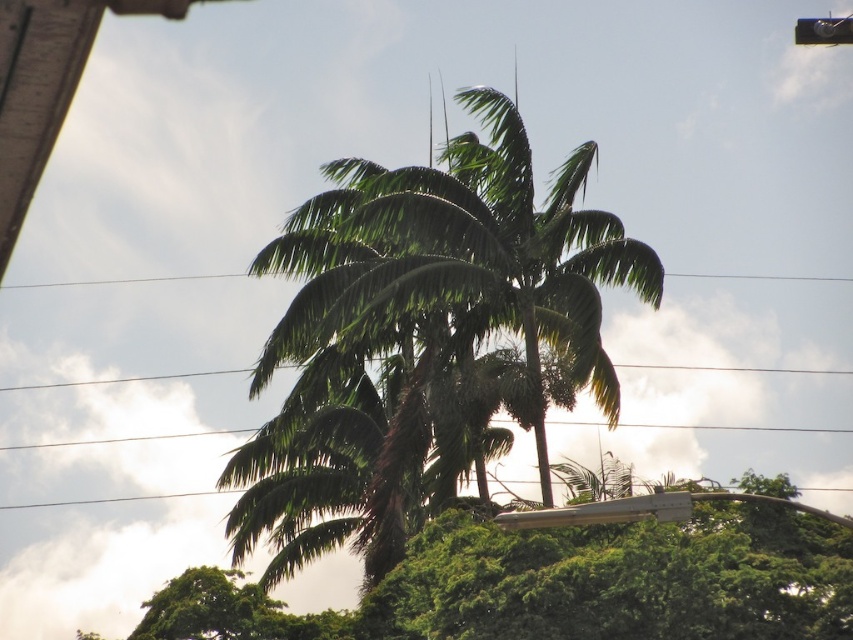
You are a bird flying in the tropical setting and want to land on a branch between the two points, point (x=282, y=360) and point (x=520, y=561). Which point should you approach first if you want to land on the nearest visible branch?

You should approach point (x=520, y=561) first because point (x=282, y=360) is behind it, making the branch at point (x=520, y=561) closer to you.

You are a bird looking for a place to perch. You see a green leafy coconut tree at center and a green leafy palm at center. Which tree would you choose if you want to land on the taller one?

The green leafy palm at center is taller than the green leafy coconut tree at center, so you should choose the green leafy palm at center to land on.